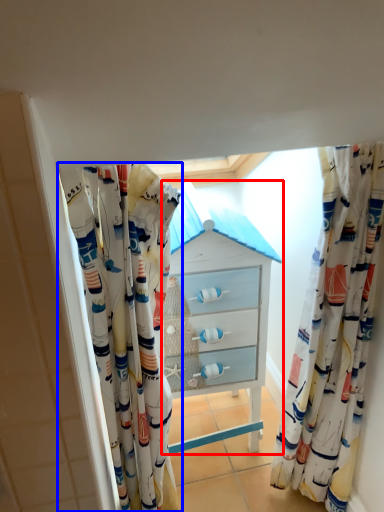
Question: Which point is closer to the camera, chest of drawers (highlighted by a red box) or curtain (highlighted by a blue box)?

Choices:
 (A) chest of drawers
 (B) curtain

Answer: (B)